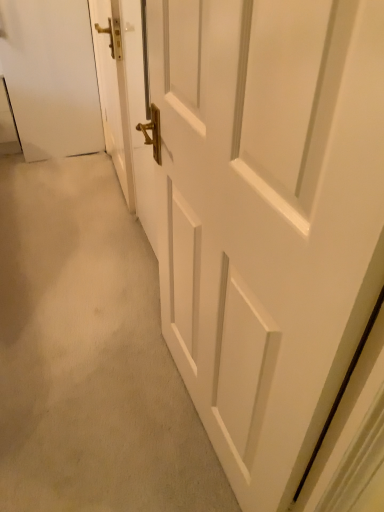
Question: Is white wooden door at left, which is the 2th door in right-to-left order, situated inside white matte door at center, the 2th door positioned from the left, or outside?

Choices:
 (A) outside
 (B) inside

Answer: (A)

Question: In terms of height, does white wooden door at left, positioned as the 1th door in left-to-right order, look taller or shorter compared to white matte door at center, the 2th door positioned from the left?

Choices:
 (A) tall
 (B) short

Answer: (B)

Question: Based on their sizes in the image, would you say white wooden door at left, which is the 2th door in right-to-left order, is bigger or smaller than white matte door at center, the first door positioned from the right?

Choices:
 (A) small
 (B) big

Answer: (A)

Question: From a real-world perspective, is white matte door at center, the 2th door positioned from the left, physically located above or below white wooden door at left, positioned as the 1th door in left-to-right order?

Choices:
 (A) above
 (B) below

Answer: (A)

Question: Looking at their shapes, would you say white matte door at center, the 2th door positioned from the left, is wider or thinner than white wooden door at left, positioned as the 1th door in left-to-right order?

Choices:
 (A) thin
 (B) wide

Answer: (B)

Question: Does point (266, 70) appear closer or farther from the camera than point (104, 78)?

Choices:
 (A) closer
 (B) farther

Answer: (A)

Question: From their relative heights in the image, would you say white matte door at center, the first door positioned from the right, is taller or shorter than white wooden door at left, positioned as the 1th door in left-to-right order?

Choices:
 (A) short
 (B) tall

Answer: (B)